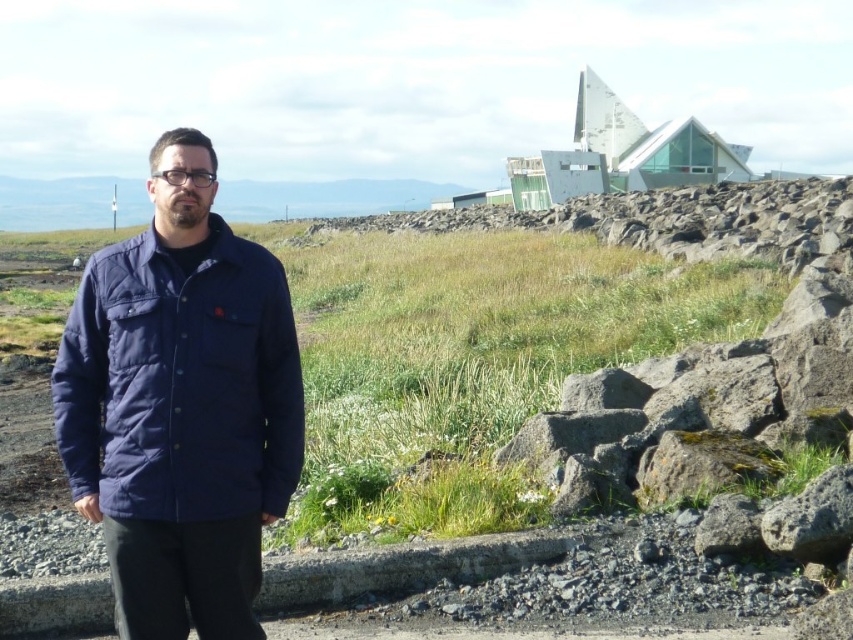
Question: Which object appears closest to the camera in this image?

Choices:
 (A) navy blue quilted jacket at center
 (B) gray rough rock at lower right
 (C) gray rough rocks at center

Answer: (A)

Question: Which object appears closest to the camera in this image?

Choices:
 (A) gray rough rocks at center
 (B) navy blue quilted jacket at center

Answer: (B)

Question: Does gray rough rocks at center appear on the left side of gray rough rock at lower right?

Choices:
 (A) no
 (B) yes

Answer: (A)

Question: Estimate the real-world distances between objects in this image. Which object is farther from the gray rough rocks at center?

Choices:
 (A) gray rough rock at lower right
 (B) navy blue quilted jacket at center

Answer: (B)

Question: Does navy blue quilted jacket at center have a greater width compared to gray rough rock at lower right?

Choices:
 (A) no
 (B) yes

Answer: (B)

Question: Does gray rough rocks at center come behind gray rough rock at lower right?

Choices:
 (A) yes
 (B) no

Answer: (B)